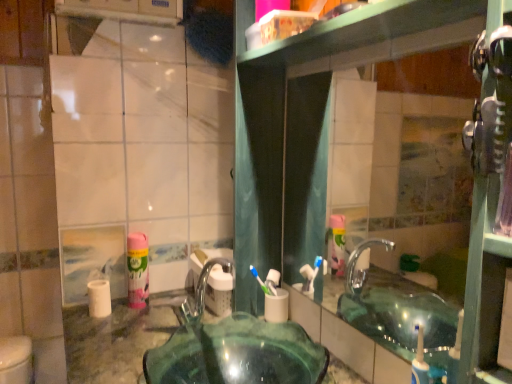
Question: Does white matte toilet paper at left, which is the second toilet paper from right to left, have a lesser width compared to pink matte mouthwash at left?

Choices:
 (A) yes
 (B) no

Answer: (B)

Question: From a real-world perspective, is white matte toilet paper at left, which is the second toilet paper from right to left, on pink matte mouthwash at left?

Choices:
 (A) no
 (B) yes

Answer: (A)

Question: Is white matte toilet paper at left, which ranks as the 1th toilet paper in left-to-right order, located outside pink matte mouthwash at left?

Choices:
 (A) no
 (B) yes

Answer: (B)

Question: Does white matte toilet paper at left, which ranks as the 1th toilet paper in left-to-right order, appear on the right side of pink matte mouthwash at left?

Choices:
 (A) no
 (B) yes

Answer: (A)

Question: Does white matte toilet paper at left, which ranks as the 1th toilet paper in left-to-right order, have a greater height compared to pink matte mouthwash at left?

Choices:
 (A) no
 (B) yes

Answer: (A)

Question: Considering the relative positions of white matte toilet paper at left, which is the second toilet paper from right to left, and pink matte mouthwash at left in the image provided, is white matte toilet paper at left, which is the second toilet paper from right to left, to the left of pink matte mouthwash at left from the viewer's perspective?

Choices:
 (A) no
 (B) yes

Answer: (B)

Question: Could you tell me if white matte toilet paper at left, which ranks as the 1th toilet paper in left-to-right order, is turned towards clear glass mirror at upper center?

Choices:
 (A) yes
 (B) no

Answer: (B)

Question: Is white matte toilet paper at left, which ranks as the 1th toilet paper in left-to-right order, positioned in front of clear glass mirror at upper center?

Choices:
 (A) no
 (B) yes

Answer: (A)

Question: Is white matte toilet paper at left, which ranks as the 1th toilet paper in left-to-right order, not close to clear glass mirror at upper center?

Choices:
 (A) no
 (B) yes

Answer: (B)

Question: From the image's perspective, is white matte toilet paper at left, which is the second toilet paper from right to left, located beneath clear glass mirror at upper center?

Choices:
 (A) no
 (B) yes

Answer: (B)

Question: Is white matte toilet paper at left, which is the second toilet paper from right to left, in contact with clear glass mirror at upper center?

Choices:
 (A) no
 (B) yes

Answer: (A)

Question: Considering the relative sizes of white matte toilet paper at left, which is the second toilet paper from right to left, and clear glass mirror at upper center in the image provided, is white matte toilet paper at left, which is the second toilet paper from right to left, wider than clear glass mirror at upper center?

Choices:
 (A) no
 (B) yes

Answer: (B)

Question: Does transparent glass sink at center appear on the left side of clear glass mirror at upper center?

Choices:
 (A) no
 (B) yes

Answer: (B)